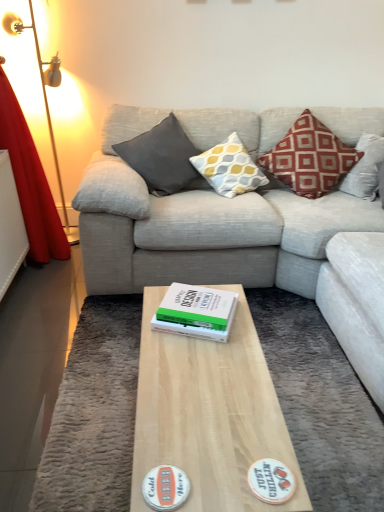
Locate an element on the screen. The image size is (384, 512). free point above white paper at center (from a real-world perspective) is located at coordinates (204, 300).